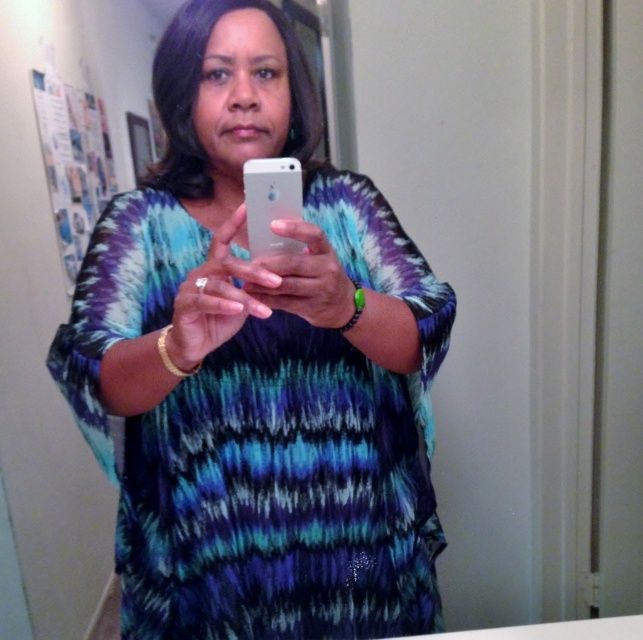
Question: Can you confirm if matte tie-dye blouse at center is positioned to the left of silver metallic phone at center?

Choices:
 (A) yes
 (B) no

Answer: (A)

Question: Is matte tie-dye blouse at center further to camera compared to silver metallic phone at center?

Choices:
 (A) yes
 (B) no

Answer: (B)

Question: Which of the following is the farthest from the observer?

Choices:
 (A) (246, 205)
 (B) (309, 122)

Answer: (B)

Question: Considering the relative positions of matte tie-dye blouse at center and silver metallic phone at center in the image provided, where is matte tie-dye blouse at center located with respect to silver metallic phone at center?

Choices:
 (A) above
 (B) below

Answer: (B)